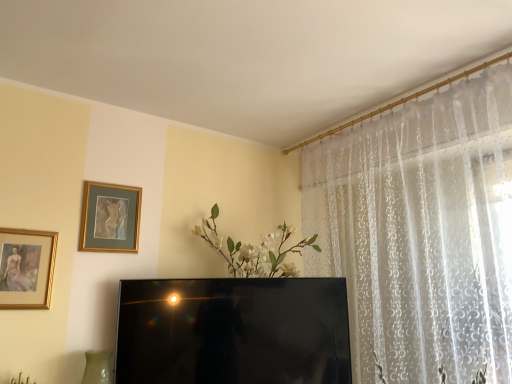
Question: From the image's perspective, is gold-framed painting at left, which is the first picture frame in front-to-back order, under black glossy television at center?

Choices:
 (A) yes
 (B) no

Answer: (B)

Question: Is gold-framed painting at left, which is the first picture frame in front-to-back order, behind black glossy television at center?

Choices:
 (A) yes
 (B) no

Answer: (B)

Question: Considering the relative sizes of gold-framed painting at left, which is the first picture frame in front-to-back order, and black glossy television at center in the image provided, is gold-framed painting at left, which is the first picture frame in front-to-back order, smaller than black glossy television at center?

Choices:
 (A) yes
 (B) no

Answer: (A)

Question: Considering the relative positions of gold-framed painting at left, which is the second picture frame in right-to-left order, and black glossy television at center in the image provided, is gold-framed painting at left, which is the second picture frame in right-to-left order, in front of black glossy television at center?

Choices:
 (A) no
 (B) yes

Answer: (B)

Question: From a real-world perspective, is gold-framed painting at left, acting as the first picture frame starting from the left, beneath black glossy television at center?

Choices:
 (A) yes
 (B) no

Answer: (B)

Question: Is gold-framed painting at left, which is the first picture frame in front-to-back order, wider or thinner than black glossy television at center?

Choices:
 (A) thin
 (B) wide

Answer: (A)

Question: Choose the correct answer: Is gold-framed painting at left, which is the first picture frame in front-to-back order, inside black glossy television at center or outside it?

Choices:
 (A) outside
 (B) inside

Answer: (A)

Question: From the image's perspective, is gold-framed painting at left, marked as the 2th picture frame in a back-to-front arrangement, above or below black glossy television at center?

Choices:
 (A) below
 (B) above

Answer: (B)

Question: Is gold-framed painting at left, which is the first picture frame in front-to-back order, taller or shorter than black glossy television at center?

Choices:
 (A) short
 (B) tall

Answer: (A)

Question: From the image's perspective, is gold-framed painting at upper left, marked as the 1th picture frame in a back-to-front arrangement, above or below gold-framed painting at left, marked as the 2th picture frame in a back-to-front arrangement?

Choices:
 (A) below
 (B) above

Answer: (B)

Question: Considering their positions, is gold-framed painting at upper left, marked as the 1th picture frame in a back-to-front arrangement, located in front of or behind gold-framed painting at left, acting as the first picture frame starting from the left?

Choices:
 (A) behind
 (B) front

Answer: (A)

Question: Visually, is gold-framed painting at upper left, which is counted as the first picture frame, starting from the right, positioned to the left or to the right of gold-framed painting at left, acting as the first picture frame starting from the left?

Choices:
 (A) left
 (B) right

Answer: (B)

Question: From a real-world perspective, is gold-framed painting at upper left, the 2th picture frame from the front, above or below gold-framed painting at left, which is the first picture frame in front-to-back order?

Choices:
 (A) above
 (B) below

Answer: (A)

Question: In terms of width, does gold-framed painting at upper left, marked as the 1th picture frame in a back-to-front arrangement, look wider or thinner when compared to black glossy television at center?

Choices:
 (A) thin
 (B) wide

Answer: (A)

Question: Considering the relative positions of gold-framed painting at upper left, which is counted as the first picture frame, starting from the right, and black glossy television at center in the image provided, is gold-framed painting at upper left, which is counted as the first picture frame, starting from the right, to the left or to the right of black glossy television at center?

Choices:
 (A) right
 (B) left

Answer: (B)